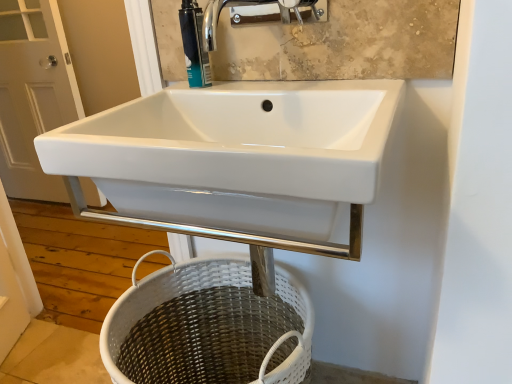
This screenshot has height=384, width=512. Identify the location of free location to the right of teal plastic soap dispenser at upper center. (262, 89).